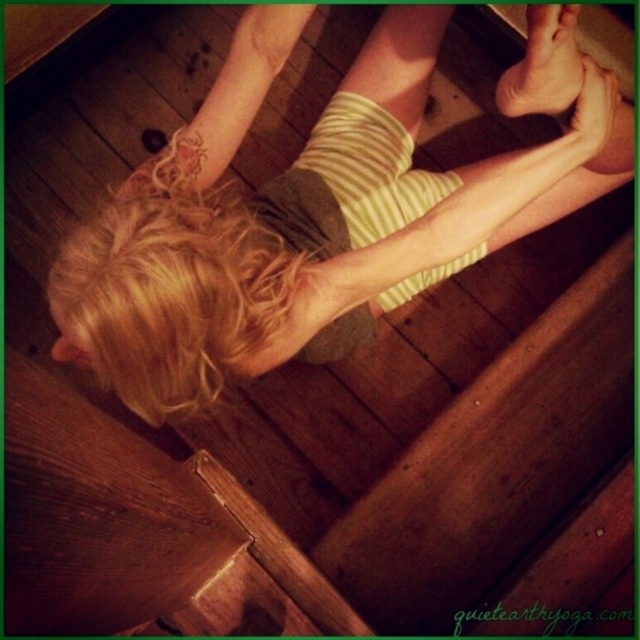
Question: Is blonde hair at upper center closer to the viewer compared to smooth skin foot at upper center?

Choices:
 (A) no
 (B) yes

Answer: (A)

Question: Which object is farther from the camera taking this photo?

Choices:
 (A) blonde hair at upper center
 (B) smooth skin foot at upper center

Answer: (A)

Question: Which point is closer to the camera taking this photo?

Choices:
 (A) pyautogui.click(x=544, y=13)
 (B) pyautogui.click(x=608, y=161)

Answer: (A)

Question: Is blonde hair at upper center positioned before smooth skin foot at upper center?

Choices:
 (A) no
 (B) yes

Answer: (A)

Question: In this image, where is blonde hair at upper center located relative to smooth skin foot at upper center?

Choices:
 (A) right
 (B) left

Answer: (B)

Question: Which point is farther to the camera?

Choices:
 (A) (540, 106)
 (B) (115, 260)

Answer: (A)